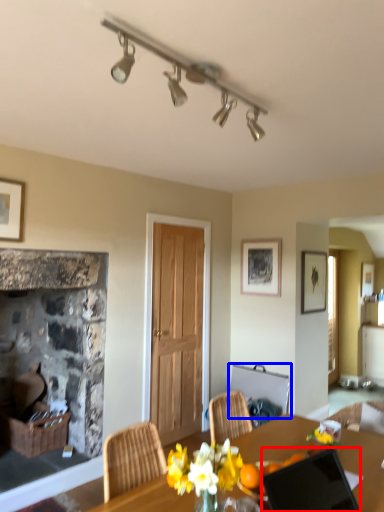
Question: Among these objects, which one is farthest to the camera, laptop (highlighted by a red box) or chair (highlighted by a blue box)?

Choices:
 (A) laptop
 (B) chair

Answer: (B)